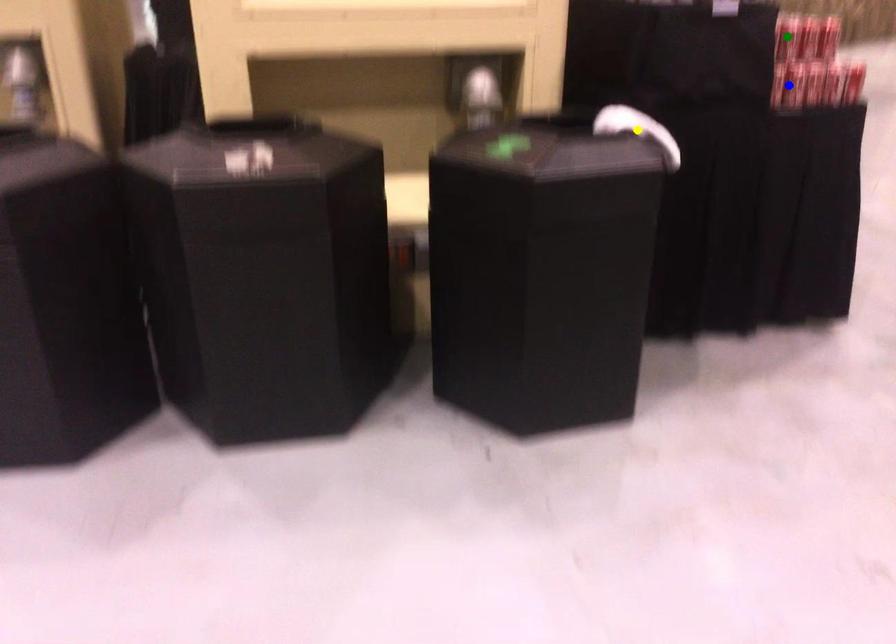
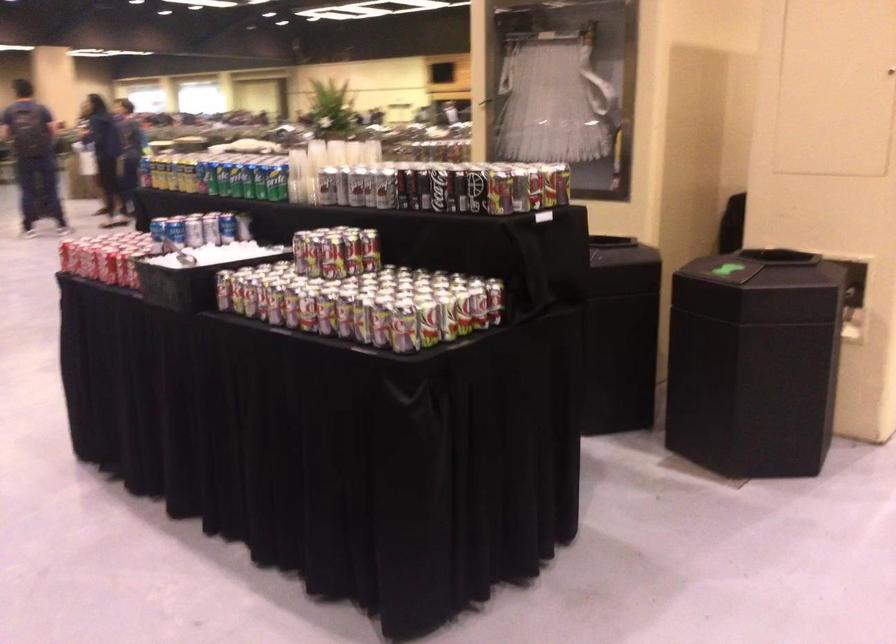
I am providing you with two images of the same scene from different viewpoints. Three points are marked in image1. Which point corresponds to a part or object that is occluded in image2?In image1, three points are marked. Which of them correspond to a part or object that is occluded in image2?Among the three points shown in image1, which one corresponds to a part or object that is no longer visible due to occlusion in image2?

yellow point, green point, blue point